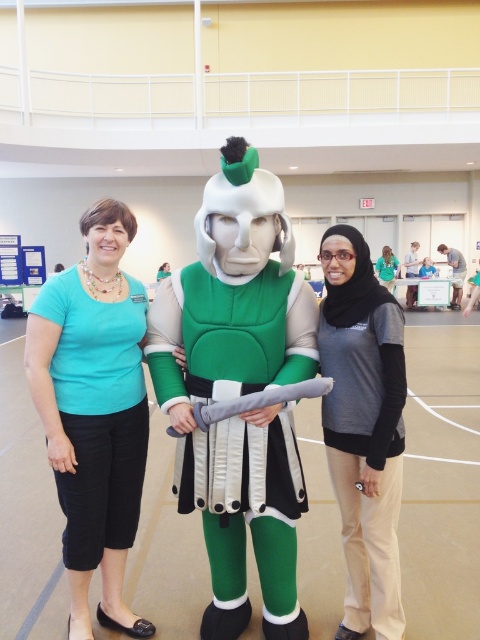
You are taking a photo of the two people wearing the matte teal shirt at center and the matte green shirt at center. Which one should you zoom in on to capture their full torso in the frame?

The matte teal shirt at center has a lesser width compared to the matte green shirt at center, so you should zoom in on the matte green shirt at center to capture its full torso since it is wider.

You are a photographer setting up for a group photo. You have two subjects wearing a matte teal shirt at center and a matte gray sweater at center. Which one should you position closer to the camera to ensure both appear equally tall in the photo?

The matte teal shirt at center is much taller than the matte gray sweater at center, so you should position the matte gray sweater at center closer to the camera to balance their heights in the photo.

You are organizing a group photo and need to ensure everyone fits within the camera frame. The camera can only accommodate a maximum width of 1.8 meters. Given that the green matte costume at center is wider than the matte teal shirt at center, will both objects fit within the frame if placed side by side?

The green matte costume at center is wider than the matte teal shirt at center. However, without knowing the exact widths of both objects, it is impossible to determine if their combined width exceeds the camera frame limit of 1.8 meters. Additional measurements are needed.